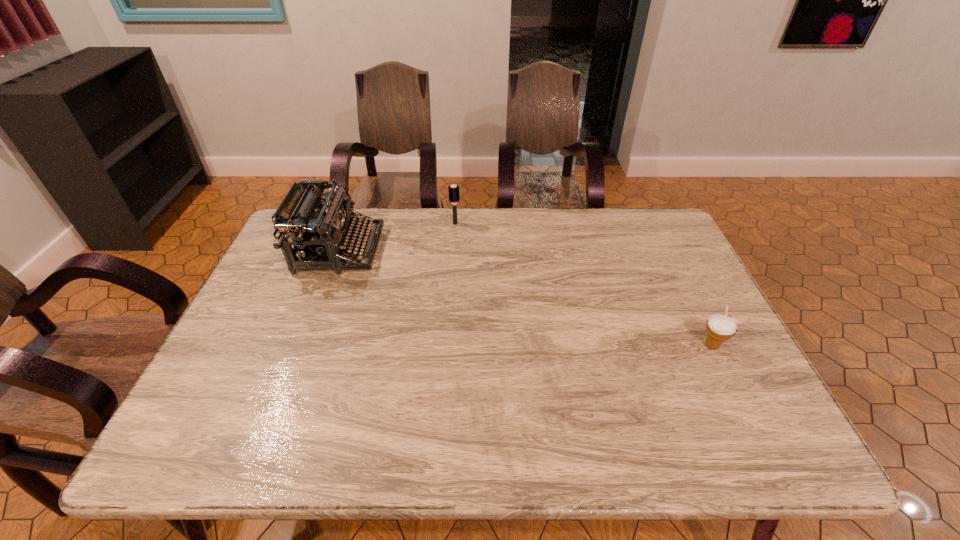
Identify the location of free space between the hairbrush and the tallest object. The image size is (960, 540). (397, 237).

Choose which object is the second nearest neighbor to the rightmost object. Please provide its 2D coordinates. Your answer should be formatted as a tuple, i.e. [(x, y)], where the tuple contains the x and y coordinates of a point satisfying the conditions above.

[(315, 234)]

Image resolution: width=960 pixels, height=540 pixels. Identify the location of object that is the closest to the nearest object. (453, 190).

Where is `vacant space that satisfies the following two spatial constraints: 1. on the typing side of the leftmost object; 2. on the right side of the icecream`? The image size is (960, 540). vacant space that satisfies the following two spatial constraints: 1. on the typing side of the leftmost object; 2. on the right side of the icecream is located at coordinates point(302,346).

You are a GUI agent. You are given a task and a screenshot of the screen. Output one action in this format:
    pyautogui.click(x=<x>, y=<y>)
    Task: Click on the vacant area in the image that satisfies the following two spatial constraints: 1. on the front side of the second object from left to right; 2. on the typing side of the typewriter
    The image size is (960, 540).
    Given the screenshot: What is the action you would take?
    pyautogui.click(x=453, y=250)

At what (x,y) coordinates should I click in order to perform the action: click on free space that satisfies the following two spatial constraints: 1. on the front side of the second object from right to left; 2. on the left side of the nearest object. Please return your answer as a coordinate pair (x, y). This screenshot has height=540, width=960. Looking at the image, I should click on (446, 346).

The height and width of the screenshot is (540, 960). I want to click on vacant space that satisfies the following two spatial constraints: 1. on the front side of the icecream; 2. on the right side of the second object from right to left, so click(x=446, y=346).

This screenshot has width=960, height=540. I want to click on free spot that satisfies the following two spatial constraints: 1. on the typing side of the leftmost object; 2. on the left side of the shortest object, so click(302, 346).

Locate an element on the screen. free space that satisfies the following two spatial constraints: 1. on the front side of the second tallest object; 2. on the typing side of the typewriter is located at coordinates (453, 250).

The width and height of the screenshot is (960, 540). What are the coordinates of `vacant space that satisfies the following two spatial constraints: 1. on the typing side of the rightmost object; 2. on the right side of the typewriter` in the screenshot? It's located at (302, 346).